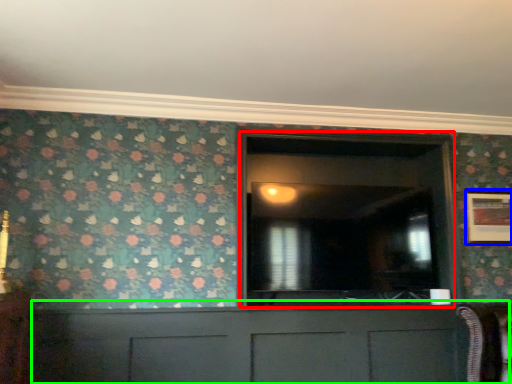
Question: Considering the real-world distances, which object is farthest from glass door (highlighted by a red box)? picture frame (highlighted by a blue box) or cabinetry (highlighted by a green box)?

Choices:
 (A) picture frame
 (B) cabinetry

Answer: (A)